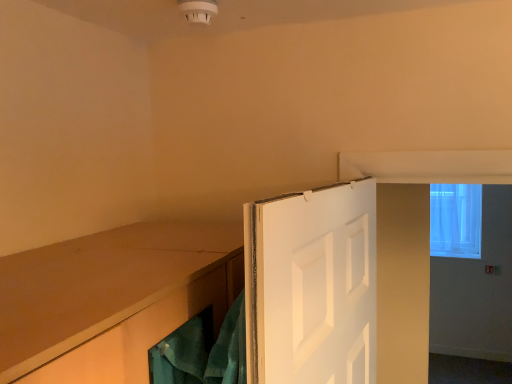
Question: Is white painted wood door at center completely or partially outside of transparent fabric window at upper right?

Choices:
 (A) no
 (B) yes

Answer: (B)

Question: Is transparent fabric window at upper right inside white painted wood door at center?

Choices:
 (A) no
 (B) yes

Answer: (A)

Question: From a real-world perspective, is white painted wood door at center located beneath transparent fabric window at upper right?

Choices:
 (A) yes
 (B) no

Answer: (B)

Question: Is white painted wood door at center bigger than transparent fabric window at upper right?

Choices:
 (A) no
 (B) yes

Answer: (B)

Question: Is the surface of white painted wood door at center in direct contact with transparent fabric window at upper right?

Choices:
 (A) no
 (B) yes

Answer: (A)

Question: From a real-world perspective, is white painted wood door at center on top of transparent fabric window at upper right?

Choices:
 (A) no
 (B) yes

Answer: (B)

Question: Is transparent fabric window at upper right at the right side of white painted wood door at center?

Choices:
 (A) yes
 (B) no

Answer: (A)

Question: Can you confirm if transparent fabric window at upper right is shorter than white painted wood door at center?

Choices:
 (A) no
 (B) yes

Answer: (A)

Question: Can you confirm if transparent fabric window at upper right is taller than white painted wood door at center?

Choices:
 (A) yes
 (B) no

Answer: (A)

Question: Is transparent fabric window at upper right bigger than white painted wood door at center?

Choices:
 (A) no
 (B) yes

Answer: (A)

Question: Could white painted wood door at center be considered to be inside transparent fabric window at upper right?

Choices:
 (A) no
 (B) yes

Answer: (A)

Question: From the image's perspective, is transparent fabric window at upper right above white painted wood door at center?

Choices:
 (A) yes
 (B) no

Answer: (A)

Question: Is white painted wood door at center taller or shorter than transparent fabric window at upper right?

Choices:
 (A) short
 (B) tall

Answer: (A)